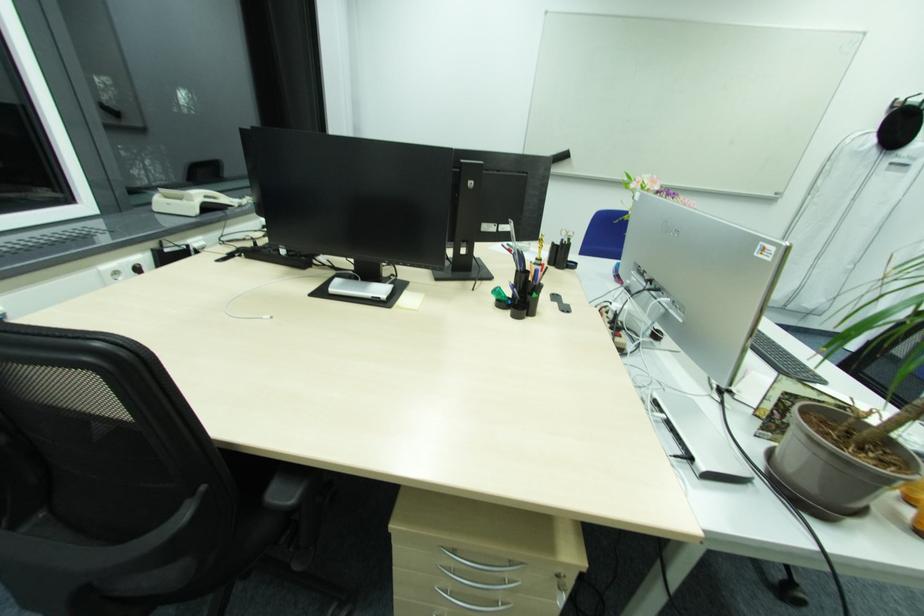
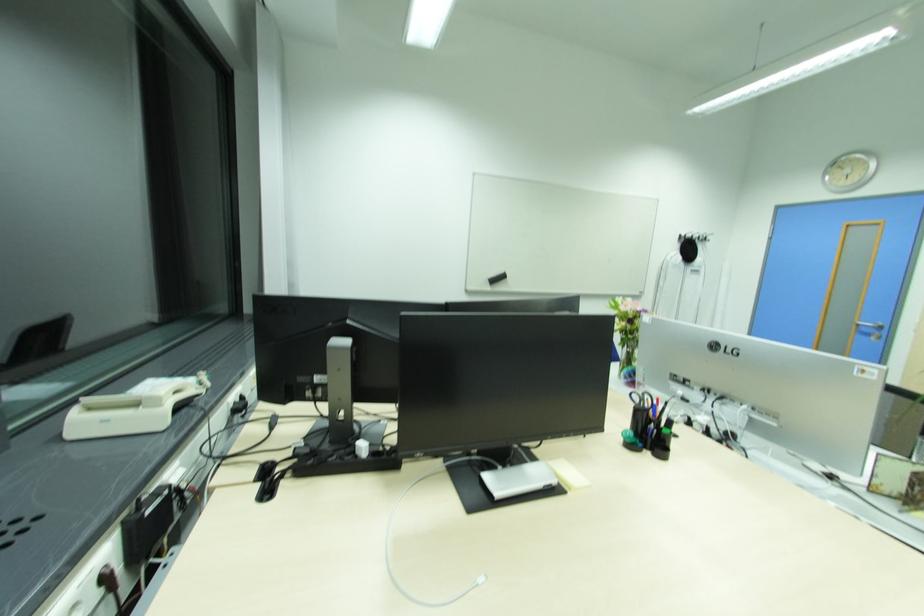
Question: The camera is either moving clockwise (left) or counter-clockwise (right) around the object. The first image is from the beginning of the video and the second image is from the end. Is the camera moving left or right when shooting the video?

Choices:
 (A) Left
 (B) Right

Answer: (A)